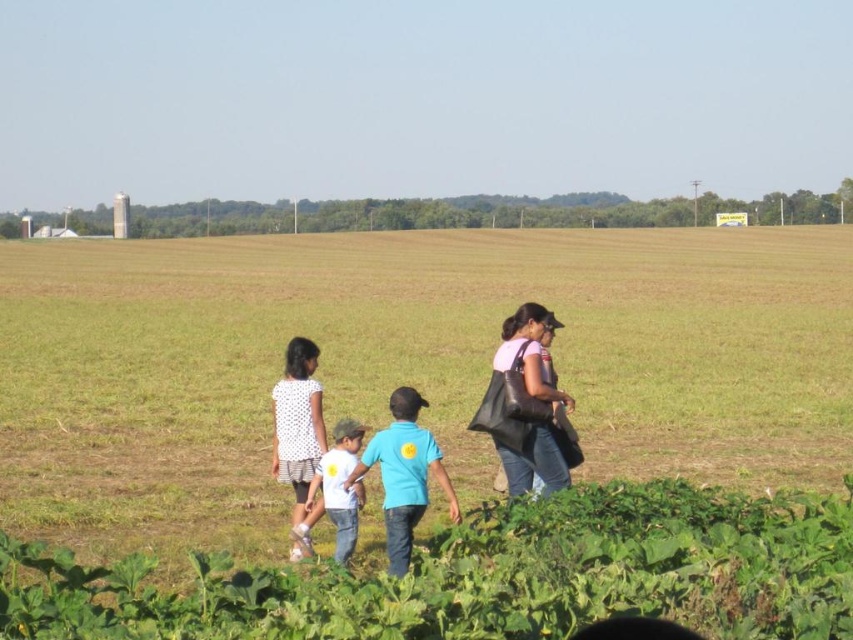
Question: Can you confirm if matte blue shirt at center is positioned below white cotton shirt at center?

Choices:
 (A) yes
 (B) no

Answer: (B)

Question: Does green grass field at center have a smaller size compared to white cotton shirt at center?

Choices:
 (A) yes
 (B) no

Answer: (B)

Question: Which point is farther from the camera taking this photo?

Choices:
 (A) (397, 452)
 (B) (492, 397)

Answer: (B)

Question: Which object is the farthest from the blue cotton shirt at center?

Choices:
 (A) white dotted dress at center
 (B) matte black bag at center
 (C) white cotton shirt at center

Answer: (B)

Question: Considering the relative positions of matte black bag at center and white dotted dress at center in the image provided, where is matte black bag at center located with respect to white dotted dress at center?

Choices:
 (A) left
 (B) right

Answer: (B)

Question: Which object is closer to the camera taking this photo?

Choices:
 (A) matte blue shirt at center
 (B) green grass field at center
 (C) matte black bag at center
 (D) blue cotton shirt at center

Answer: (B)